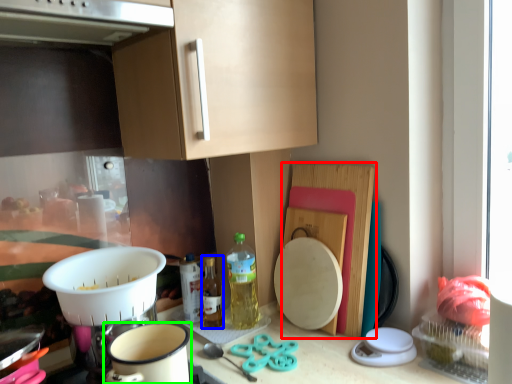
Question: Which object is the farthest from cutting board (highlighted by a red box)? Choose among these: bottle (highlighted by a blue box) or coffee cup (highlighted by a green box).

Choices:
 (A) bottle
 (B) coffee cup

Answer: (B)